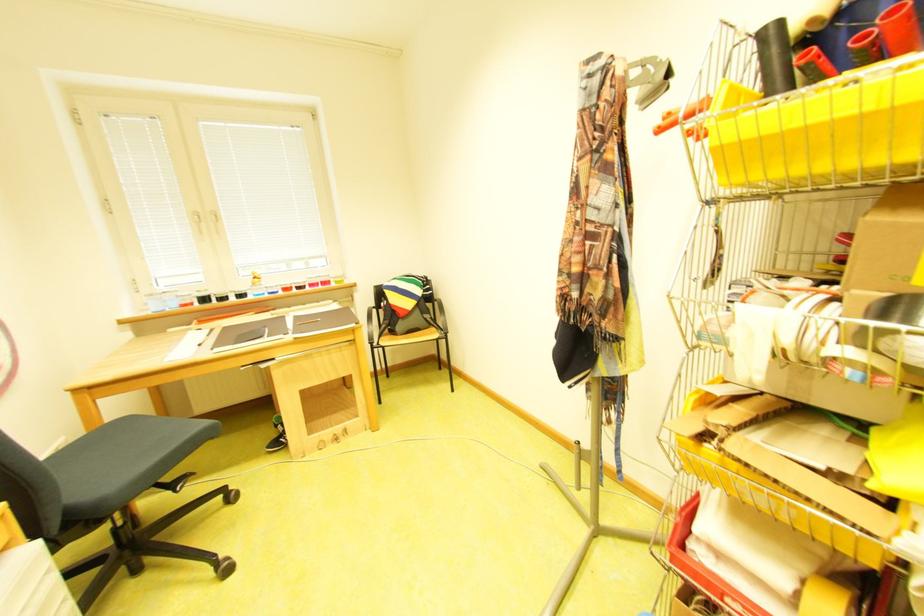
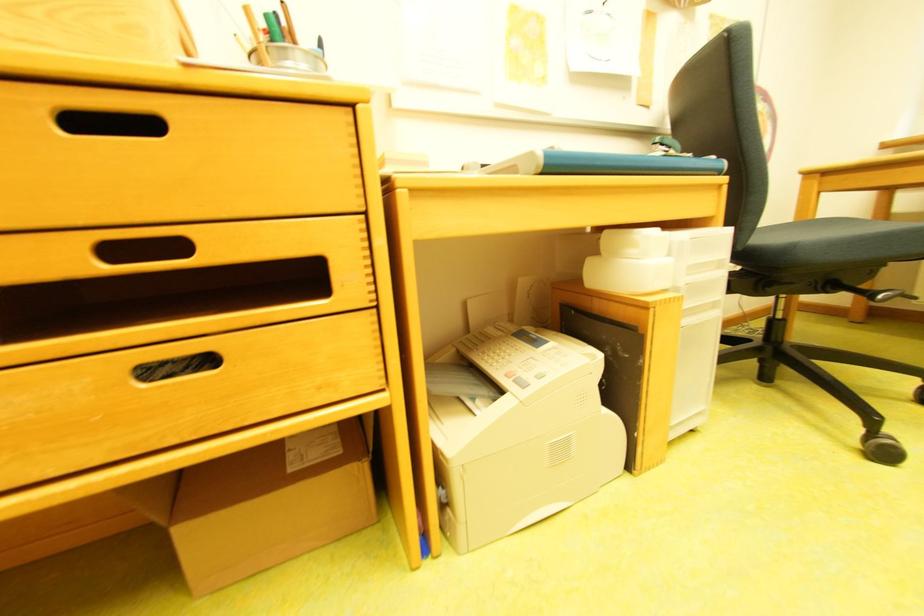
In the second image, find the point that corresponds to [110,427] in the first image.

(821, 220)